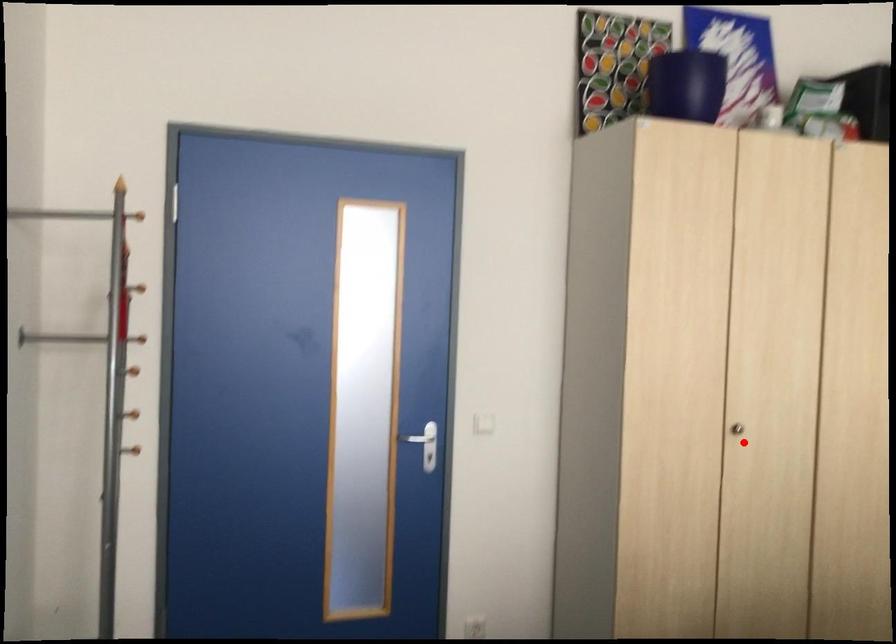
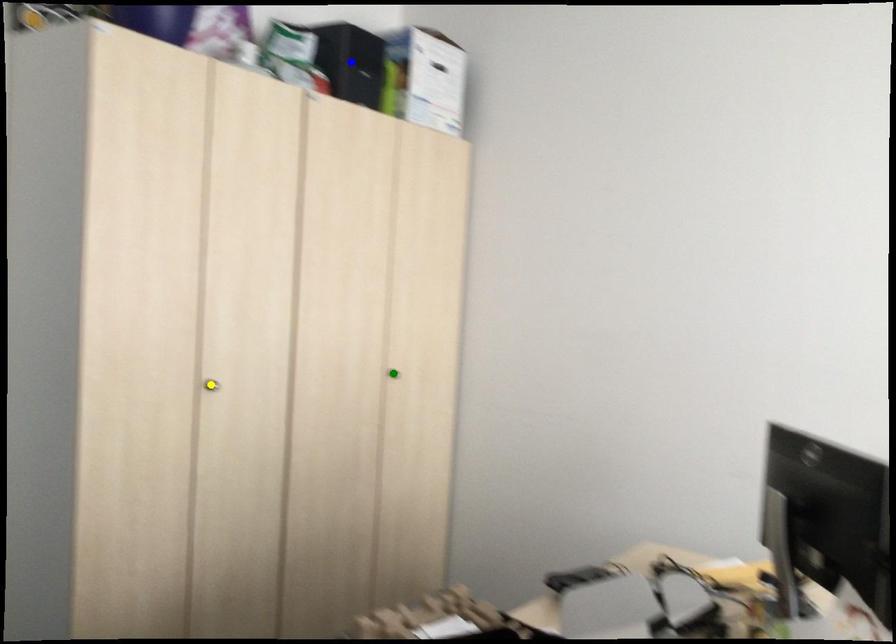
Question: I am providing you with two images of the same scene from different viewpoints. A red point is marked on the first image. You are given multiple points on the second image. Can you choose the point in image 2 that corresponds to the point in image 1?

Choices:
 (A) yellow point
 (B) blue point
 (C) green point

Answer: (A)